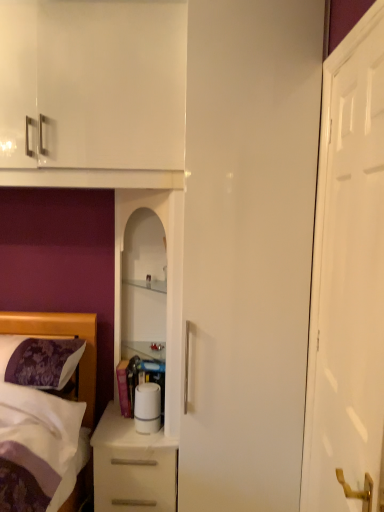
Question: Is white glossy door at right spatially inside white glossy cabinet at center, or outside of it?

Choices:
 (A) inside
 (B) outside

Answer: (B)

Question: From the image's perspective, is white glossy door at right positioned above or below white glossy cabinet at center?

Choices:
 (A) above
 (B) below

Answer: (A)

Question: Based on their relative distances, which object is farther from the white glossy cabinet at center?

Choices:
 (A) white glossy door at right
 (B) white matte chest of drawers at lower left
 (C) purple floral fabric pillow at lower left

Answer: (A)

Question: Which of these objects is positioned farthest from the white matte chest of drawers at lower left?

Choices:
 (A) purple floral fabric pillow at lower left
 (B) white glossy door at right
 (C) white glossy cabinet at center

Answer: (B)